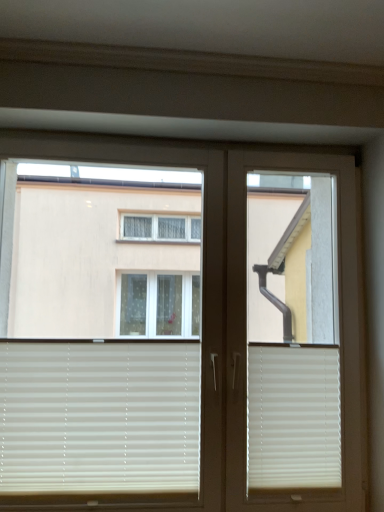
Question: Considering the relative sizes of beige matte blinds at lower left, which is counted as the 2th window blind, starting from the right, and white plastic screen door at center in the image provided, is beige matte blinds at lower left, which is counted as the 2th window blind, starting from the right, shorter than white plastic screen door at center?

Choices:
 (A) no
 (B) yes

Answer: (B)

Question: Considering the relative sizes of beige matte blinds at lower left, the first window blind in the left-to-right sequence, and white plastic screen door at center in the image provided, is beige matte blinds at lower left, the first window blind in the left-to-right sequence, thinner than white plastic screen door at center?

Choices:
 (A) yes
 (B) no

Answer: (A)

Question: Can we say beige matte blinds at lower left, the first window blind in the left-to-right sequence, lies outside white plastic screen door at center?

Choices:
 (A) yes
 (B) no

Answer: (A)

Question: Are beige matte blinds at lower left, the first window blind in the left-to-right sequence, and white plastic screen door at center located far from each other?

Choices:
 (A) yes
 (B) no

Answer: (B)

Question: Is beige matte blinds at lower left, which is counted as the 2th window blind, starting from the right, wider than white plastic screen door at center?

Choices:
 (A) no
 (B) yes

Answer: (A)

Question: Choose the correct answer: Is white plastic screen door at center inside white matte window at upper left or outside it?

Choices:
 (A) outside
 (B) inside

Answer: (A)

Question: Is white plastic screen door at center in front of or behind white matte window at upper left in the image?

Choices:
 (A) behind
 (B) front

Answer: (A)

Question: From a real-world perspective, relative to white matte window at upper left, is white plastic screen door at center vertically above or below?

Choices:
 (A) above
 (B) below

Answer: (B)

Question: Is white plastic screen door at center to the left or to the right of white matte window at upper left in the image?

Choices:
 (A) left
 (B) right

Answer: (B)

Question: Considering the positions of white matte window at upper left and white matte window blind at lower right, acting as the second window blind starting from the left, in the image, is white matte window at upper left taller or shorter than white matte window blind at lower right, acting as the second window blind starting from the left,?

Choices:
 (A) short
 (B) tall

Answer: (B)

Question: From a real-world perspective, relative to white matte window blind at lower right, which ranks as the first window blind in right-to-left order, is white matte window at upper left vertically above or below?

Choices:
 (A) above
 (B) below

Answer: (A)

Question: Looking at the image, does white matte window at upper left seem bigger or smaller compared to white matte window blind at lower right, acting as the second window blind starting from the left?

Choices:
 (A) big
 (B) small

Answer: (A)

Question: Is white matte window at upper left in front of or behind white matte window blind at lower right, which ranks as the first window blind in right-to-left order, in the image?

Choices:
 (A) behind
 (B) front

Answer: (B)

Question: In terms of width, does white plastic screen door at center look wider or thinner when compared to beige matte blinds at lower left, the first window blind in the left-to-right sequence?

Choices:
 (A) wide
 (B) thin

Answer: (A)

Question: From a real-world perspective, relative to beige matte blinds at lower left, the first window blind in the left-to-right sequence, is white plastic screen door at center vertically above or below?

Choices:
 (A) above
 (B) below

Answer: (A)